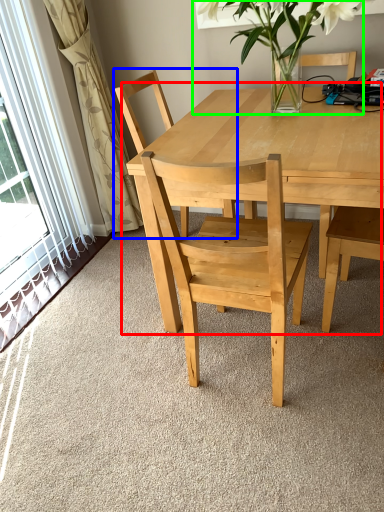
Question: Which is nearer to the kitchen & dining room table (highlighted by a red box)? chair (highlighted by a blue box) or houseplant (highlighted by a green box).

Choices:
 (A) chair
 (B) houseplant

Answer: (B)